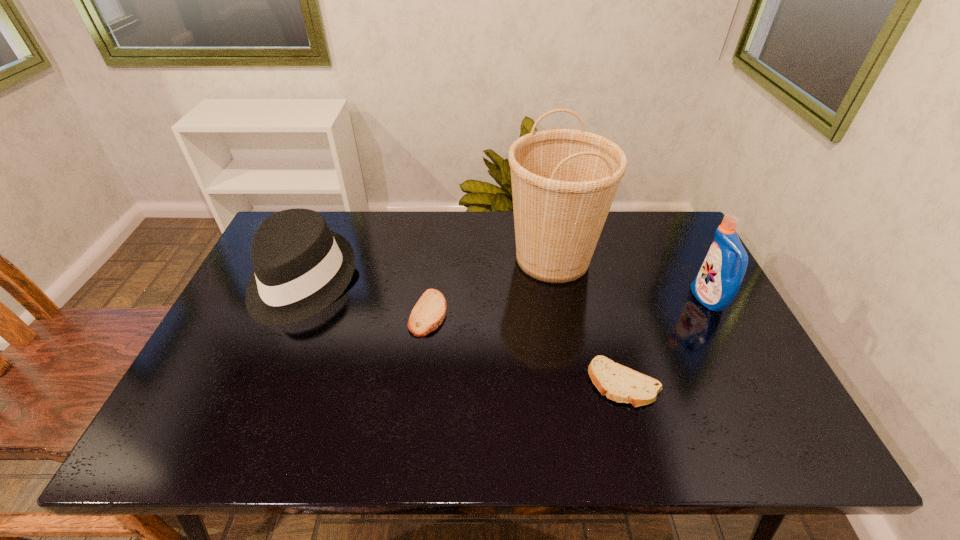
At what (x,y) coordinates should I click in order to perform the action: click on free spot located 0.390m on the label of the fourth shortest object. Please return your answer as a coordinate pair (x, y). This screenshot has width=960, height=540. Looking at the image, I should click on (556, 299).

Image resolution: width=960 pixels, height=540 pixels. Find the location of `free space located 0.140m on the label of the fourth shortest object`. free space located 0.140m on the label of the fourth shortest object is located at coordinates (645, 299).

I want to click on vacant area situated 0.330m on the label of the fourth shortest object, so click(577, 299).

Locate an element on the screen. The width and height of the screenshot is (960, 540). vacant area situated on the front of the third shortest object is located at coordinates (228, 455).

Where is `free space located on the front of the farther pita bread`? free space located on the front of the farther pita bread is located at coordinates point(421,376).

Find the location of a particular element. The image size is (960, 540). free space located on the left of the shortest object is located at coordinates (420, 383).

This screenshot has width=960, height=540. In order to click on basket that is at the far edge in this screenshot , I will do `click(564, 181)`.

At what (x,y) coordinates should I click in order to perform the action: click on fedora positioned at the far edge. Please return your answer as a coordinate pair (x, y). Looking at the image, I should click on (301, 267).

I want to click on object present at the left edge, so click(301, 267).

Image resolution: width=960 pixels, height=540 pixels. I want to click on object at the right edge, so click(x=717, y=283).